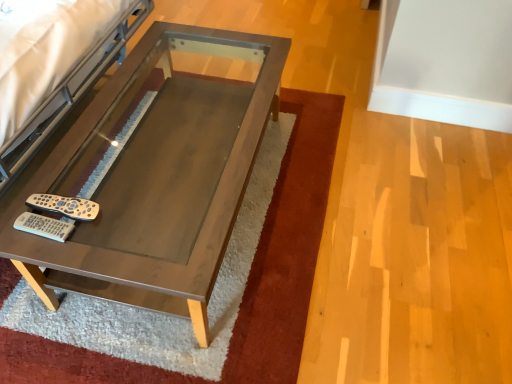
I want to click on matte wood table at center, so click(153, 177).

What is the approximate height of matte wood table at center?

matte wood table at center is 15.75 inches tall.

The height and width of the screenshot is (384, 512). Describe the element at coordinates (153, 177) in the screenshot. I see `matte wood table at center` at that location.

Where is `silver metallic remote at lower left`? silver metallic remote at lower left is located at coordinates (64, 206).

Describe the element at coordinates (64, 206) in the screenshot. The image size is (512, 384). I see `silver metallic remote at lower left` at that location.

Image resolution: width=512 pixels, height=384 pixels. Find the location of `matte wood table at center`. matte wood table at center is located at coordinates (153, 177).

Based on the photo, considering the relative positions of matte wood table at center and silver metallic remote at lower left in the image provided, is matte wood table at center to the right of silver metallic remote at lower left from the viewer's perspective?

Yes.

Who is more distant, matte wood table at center or silver metallic remote at lower left?

Positioned behind is silver metallic remote at lower left.

Is point (280, 47) closer or farther from the camera than point (69, 216)?

Clearly, point (280, 47) is more distant from the camera than point (69, 216).

From the image's perspective, who appears lower, matte wood table at center or silver metallic remote at lower left?

silver metallic remote at lower left appears lower in the image.

From a real-world perspective, which object stands above the other?

silver metallic remote at lower left.

Looking at this image, is matte wood table at center wider than silver metallic remote at lower left?

Yes.

Considering the sizes of matte wood table at center and silver metallic remote at lower left in the image, is matte wood table at center taller or shorter than silver metallic remote at lower left?

In the image, matte wood table at center appears to be taller than silver metallic remote at lower left.

Is matte wood table at center bigger than silver metallic remote at lower left?

Yes.

Looking at this image, is matte wood table at center situated inside silver metallic remote at lower left or outside?

matte wood table at center cannot be found inside silver metallic remote at lower left.

Are matte wood table at center and silver metallic remote at lower left located far from each other?

That's not correct — matte wood table at center is a little close to silver metallic remote at lower left.

Is matte wood table at center oriented towards silver metallic remote at lower left?

No, matte wood table at center is not facing towards silver metallic remote at lower left.

How many degrees apart are the facing directions of matte wood table at center and silver metallic remote at lower left?

matte wood table at center and silver metallic remote at lower left are facing 0.0121 degrees away from each other.

Identify the location of remote below the matte wood table at center (from the image's perspective). The image size is (512, 384). (64, 206).

Between silver metallic remote at lower left and matte wood table at center, which one appears on the right side from the viewer's perspective?

matte wood table at center is more to the right.

Considering their positions, is silver metallic remote at lower left located in front of or behind matte wood table at center?

In the image, silver metallic remote at lower left appears behind matte wood table at center.

Considering the positions of points (86, 212) and (165, 201), is point (86, 212) closer to camera compared to point (165, 201)?

Yes, point (86, 212) is closer to viewer.

From the picture: From the image's perspective, is silver metallic remote at lower left over matte wood table at center?

No, from the image's perspective, silver metallic remote at lower left is not on top of matte wood table at center.

From a real-world perspective, is silver metallic remote at lower left on top of matte wood table at center?

Yes, from a real-world perspective, silver metallic remote at lower left is above matte wood table at center.

Can you confirm if silver metallic remote at lower left is thinner than matte wood table at center?

Yes.

Which of these two, silver metallic remote at lower left or matte wood table at center, stands shorter?

With less height is silver metallic remote at lower left.

Consider the image. Considering the relative sizes of silver metallic remote at lower left and matte wood table at center in the image provided, is silver metallic remote at lower left smaller than matte wood table at center?

Yes.

Do you think silver metallic remote at lower left is within matte wood table at center, or outside of it?

silver metallic remote at lower left is located inside matte wood table at center.

Is silver metallic remote at lower left in contact with matte wood table at center?

No, silver metallic remote at lower left is not beside matte wood table at center.

Is silver metallic remote at lower left oriented away from matte wood table at center?

No.

Locate an element on the screen. table on the right of silver metallic remote at lower left is located at coordinates (153, 177).

Identify the location of remote below the matte wood table at center (from the image's perspective). click(64, 206).

Identify the location of remote behind the matte wood table at center. This screenshot has height=384, width=512. (64, 206).